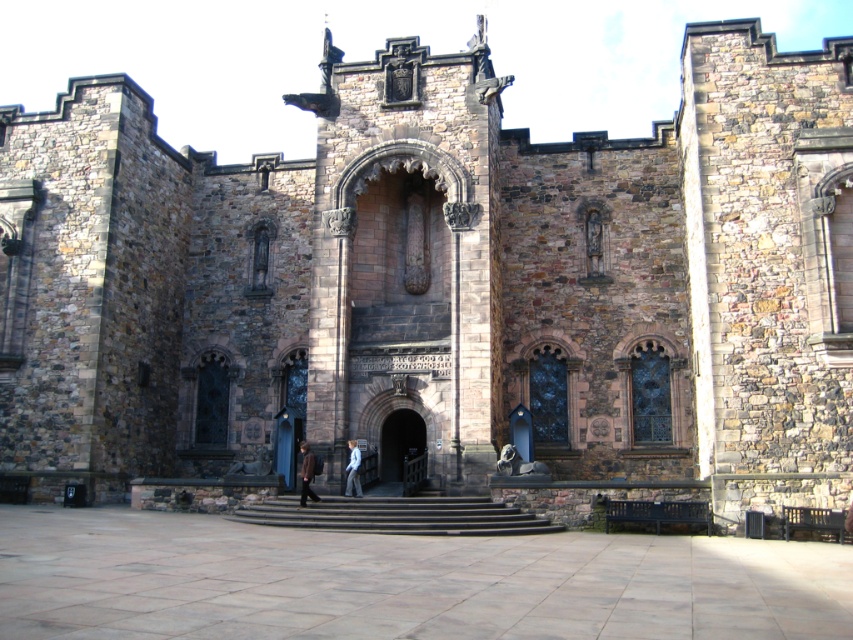
Who is higher up, dark stone archway at center or brown leather jacket at center?

Positioned higher is dark stone archway at center.

Consider the image. Who is positioned more to the left, dark stone archway at center or brown leather jacket at center?

Positioned to the left is brown leather jacket at center.

The width and height of the screenshot is (853, 640). What are the coordinates of `dark stone archway at center` in the screenshot? It's located at (399, 440).

The height and width of the screenshot is (640, 853). What are the coordinates of `dark stone archway at center` in the screenshot? It's located at (399, 440).

Which is above, black stone stairs at center or light blue denim jacket at center?

light blue denim jacket at center is above.

Is black stone stairs at center wider than light blue denim jacket at center?

Yes, black stone stairs at center is wider than light blue denim jacket at center.

Which is in front, point (485, 531) or point (357, 492)?

Point (485, 531) is more forward.

Identify the location of black stone stairs at center. This screenshot has width=853, height=640. (398, 515).

Between brown leather jacket at center and light blue denim jacket at center, which one has more height?

brown leather jacket at center is taller.

What do you see at coordinates (306, 474) in the screenshot? The image size is (853, 640). I see `brown leather jacket at center` at bounding box center [306, 474].

Who is more distant from viewer, (305,472) or (358,458)?

Point (358,458)

Find the location of a particular element. This screenshot has height=640, width=853. brown leather jacket at center is located at coordinates (306, 474).